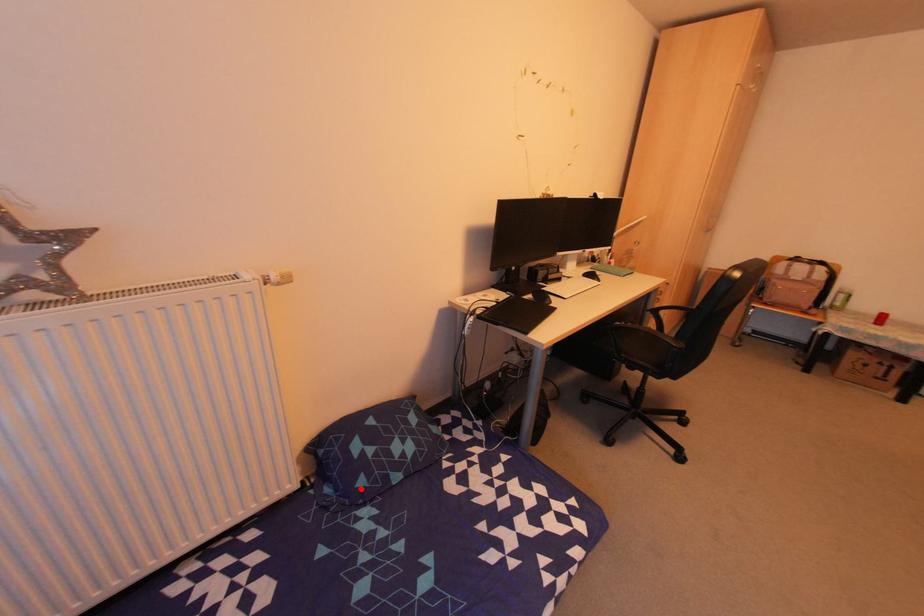
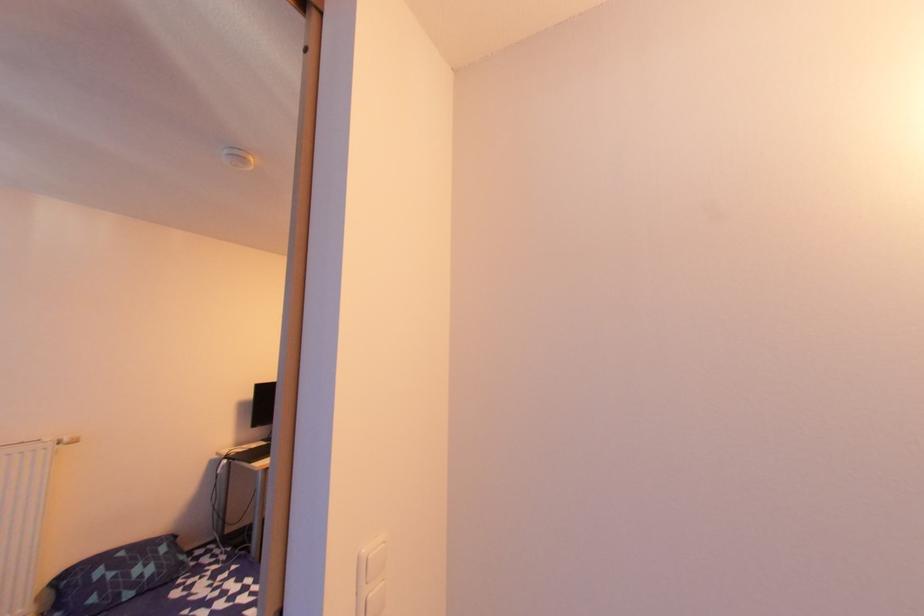
Question: A red point is marked in image1. In image2, is the corresponding 3D point closer to the camera or farther? Reply with the corresponding letter.

Choices:
 (A) The corresponding 3D point is closer.
 (B) The corresponding 3D point is farther.

Answer: (A)